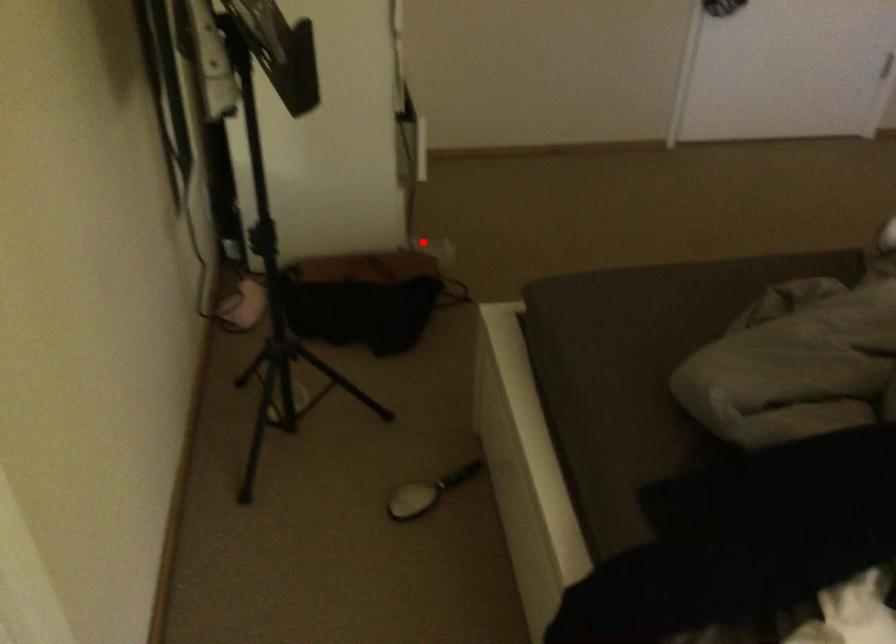
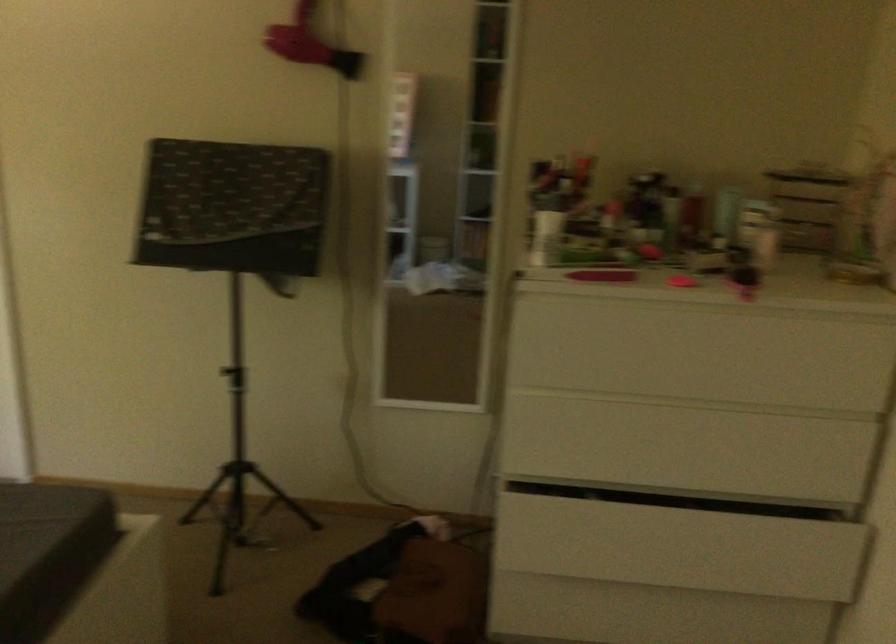
Where in the second image is the point corresponding to the highlighted location from the first image?

(435, 589)